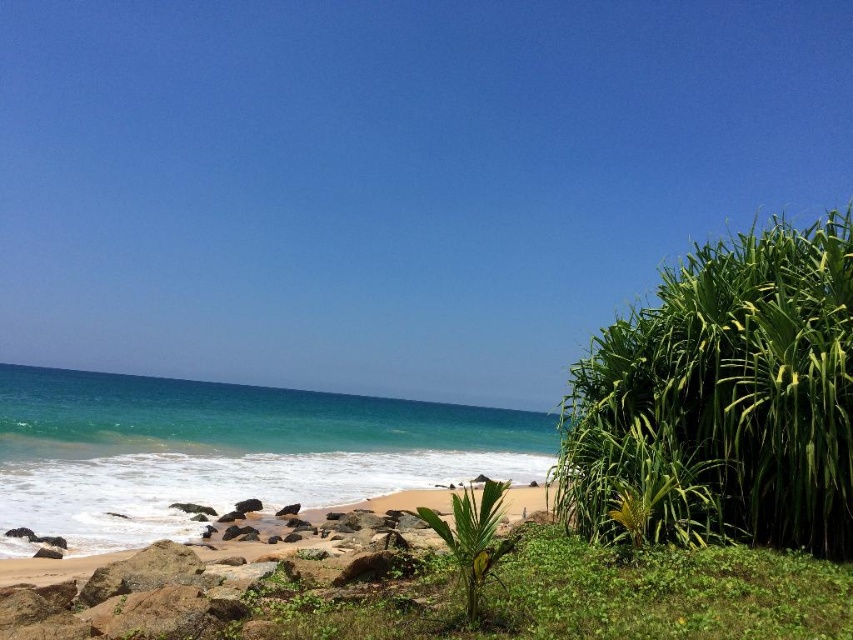
Question: Among these points, which one is nearest to the camera?

Choices:
 (A) (747, 305)
 (B) (450, 502)

Answer: (A)

Question: Is green leafy bush at right positioned at the back of brown sandy beach at lower left?

Choices:
 (A) no
 (B) yes

Answer: (A)

Question: In this image, where is green leafy bush at right located relative to brown sandy beach at lower left?

Choices:
 (A) left
 (B) right

Answer: (B)

Question: Which point appears farthest from the camera in this image?

Choices:
 (A) (756, 531)
 (B) (416, 506)
 (C) (88, 502)

Answer: (B)

Question: Which object is closer to the camera taking this photo?

Choices:
 (A) green leafy bush at right
 (B) brown sandy beach at lower left

Answer: (A)

Question: Is green leafy bush at right above turquoise glossy water at center?

Choices:
 (A) no
 (B) yes

Answer: (B)